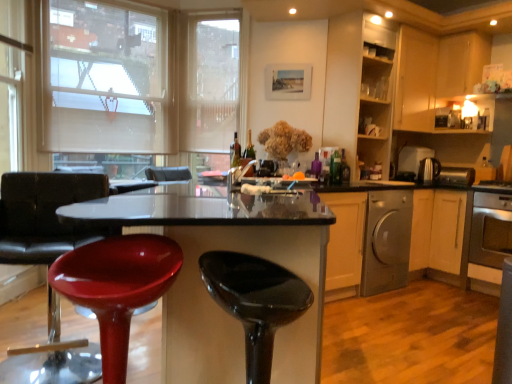
The width and height of the screenshot is (512, 384). What are the coordinates of `translucent fabric at center, positioned as the second window screen in left-to-right order` in the screenshot? It's located at click(210, 84).

Locate an element on the screen. Image resolution: width=512 pixels, height=384 pixels. glossy black bar stool at center is located at coordinates (255, 302).

In order to face glossy black bar stool at center, should I rotate leftwards or rightwards?

Rotate your view right by about 0.497°.

What is the approximate width of glossy plastic table at center?

3.57 feet.

The width and height of the screenshot is (512, 384). I want to click on wooden cabinet at upper right, which is the third cabinetry in right-to-left order, so click(x=359, y=89).

From a real-world perspective, which cabinetry is the 1st one above the green glass bottle at center, the 3th bottle when ordered from right to left? Please provide its 2D coordinates.

[(359, 89)]

Who is smaller, green glass bottle at center, the 3th bottle when ordered from right to left, or wooden cabinet at upper right, which is the first cabinetry in left-to-right order?

With smaller size is green glass bottle at center, the 3th bottle when ordered from right to left.

Is green glass bottle at center, the 3th bottle when ordered from right to left, not within wooden cabinet at upper right, which is the first cabinetry in left-to-right order?

green glass bottle at center, the 3th bottle when ordered from right to left, lies outside wooden cabinet at upper right, which is the first cabinetry in left-to-right order,'s area.

Consider the image. Is wooden cabinet at upper right, the 1th cabinetry in the right-to-left sequence, aimed at green glass bottle at center, which is the first bottle in left-to-right order?

No, wooden cabinet at upper right, the 1th cabinetry in the right-to-left sequence, is not aimed at green glass bottle at center, which is the first bottle in left-to-right order.

From the image's perspective, does wooden cabinet at upper right, the third cabinetry from the left, appear higher than green glass bottle at center, which is the first bottle in left-to-right order?

Yes, from the image's perspective, wooden cabinet at upper right, the third cabinetry from the left, is over green glass bottle at center, which is the first bottle in left-to-right order.

From a real-world perspective, which is physically below, wooden cabinet at upper right, the 1th cabinetry in the right-to-left sequence, or green glass bottle at center, which is the first bottle in left-to-right order?

green glass bottle at center, which is the first bottle in left-to-right order.

Could you measure the distance between glossy black bar stool at center and metallic silver toaster at right, marked as the 1th appliance in a right-to-left arrangement?

glossy black bar stool at center and metallic silver toaster at right, marked as the 1th appliance in a right-to-left arrangement, are 9.46 feet apart from each other.

Could you tell me if glossy black bar stool at center is turned towards metallic silver toaster at right, the third appliance viewed from the left?

No, glossy black bar stool at center does not turn towards metallic silver toaster at right, the third appliance viewed from the left.

Find the location of a particular element. The width and height of the screenshot is (512, 384). bar stool in front of the metallic silver toaster at right, marked as the 1th appliance in a right-to-left arrangement is located at coordinates (255, 302).

Is glossy black bar stool at center next to metallic silver toaster at right, marked as the 1th appliance in a right-to-left arrangement?

glossy black bar stool at center and metallic silver toaster at right, marked as the 1th appliance in a right-to-left arrangement, are not in contact.

From the image's perspective, would you say silver metallic dishwasher at lower right is positioned over wooden cabinet at upper right, the third cabinetry from the left?

Incorrect, from the image's perspective, silver metallic dishwasher at lower right is lower than wooden cabinet at upper right, the third cabinetry from the left.

From a real-world perspective, which cabinetry is the 3rd one above the silver metallic dishwasher at lower right? Please provide its 2D coordinates.

[(461, 62)]

Considering the positions of objects silver metallic dishwasher at lower right and wooden cabinet at upper right, the third cabinetry from the left, in the image provided, who is more to the right, silver metallic dishwasher at lower right or wooden cabinet at upper right, the third cabinetry from the left,?

From the viewer's perspective, wooden cabinet at upper right, the third cabinetry from the left, appears more on the right side.

Is silver metallic dishwasher at lower right situated inside wooden cabinet at upper right, the third cabinetry from the left, or outside?

The correct answer is: outside.

Which of these two, green glass bottle at center, which is the first bottle in left-to-right order, or metallic silver toaster at right, the third appliance viewed from the left, is thinner?

With smaller width is green glass bottle at center, which is the first bottle in left-to-right order.

From the image's perspective, does green glass bottle at center, the 3th bottle when ordered from right to left, appear higher than metallic silver toaster at right, marked as the 1th appliance in a right-to-left arrangement?

Yes, from the image's perspective, green glass bottle at center, the 3th bottle when ordered from right to left, is over metallic silver toaster at right, marked as the 1th appliance in a right-to-left arrangement.

How much distance is there between green glass bottle at center, which is the first bottle in left-to-right order, and metallic silver toaster at right, marked as the 1th appliance in a right-to-left arrangement?

A distance of 6.96 feet exists between green glass bottle at center, which is the first bottle in left-to-right order, and metallic silver toaster at right, marked as the 1th appliance in a right-to-left arrangement.

Is green glass bottle at center, which is the first bottle in left-to-right order, closer to the viewer compared to metallic silver toaster at right, the third appliance viewed from the left?

Yes, the depth of green glass bottle at center, which is the first bottle in left-to-right order, is less than that of metallic silver toaster at right, the third appliance viewed from the left.

From the image's perspective, is wooden cabinet at upper right, the third cabinetry from the left, beneath translucent glass bottle at center, positioned as the 2th bottle in left-to-right order?

Incorrect, from the image's perspective, wooden cabinet at upper right, the third cabinetry from the left, is higher than translucent glass bottle at center, positioned as the 2th bottle in left-to-right order.

Where is `cabinetry that is the 3rd object above the translucent glass bottle at center, which is the second bottle in right-to-left order (from a real-world perspective)`? cabinetry that is the 3rd object above the translucent glass bottle at center, which is the second bottle in right-to-left order (from a real-world perspective) is located at coordinates (461, 62).

Which of these two, wooden cabinet at upper right, the third cabinetry from the left, or translucent glass bottle at center, positioned as the 2th bottle in left-to-right order, stands taller?

Standing taller between the two is wooden cabinet at upper right, the third cabinetry from the left.

Does point (475, 75) come behind point (248, 137)?

No, it is not.

Is point (463, 170) more distant than point (457, 46)?

Yes, point (463, 170) is behind point (457, 46).

From a real-world perspective, is metallic silver toaster at right, the third appliance viewed from the left, on wooden cabinet at upper right, which is the second cabinetry in left-to-right order?

No, from a real-world perspective, metallic silver toaster at right, the third appliance viewed from the left, is not above wooden cabinet at upper right, which is the second cabinetry in left-to-right order.

Is metallic silver toaster at right, marked as the 1th appliance in a right-to-left arrangement, looking in the opposite direction of wooden cabinet at upper right, which is the second cabinetry in left-to-right order?

No.

In terms of size, does metallic silver toaster at right, the third appliance viewed from the left, appear bigger or smaller than wooden cabinet at upper right, marked as the second cabinetry in a right-to-left arrangement?

In the image, metallic silver toaster at right, the third appliance viewed from the left, appears to be smaller than wooden cabinet at upper right, marked as the second cabinetry in a right-to-left arrangement.

The height and width of the screenshot is (384, 512). I want to click on bottle that is the 2nd one below the wooden cabinet at upper right, which is the first cabinetry in left-to-right order (from a real-world perspective), so click(234, 152).

What are the coordinates of `the 3rd bottle to the left of the wooden cabinet at upper right, the third cabinetry from the left, counting from the anchor's position` in the screenshot? It's located at (234, 152).

From the picture: Which object lies nearer to the anchor point glossy plastic stool at center, the 1th chair when ordered from front to back, wooden cabinet at upper right, which is the second cabinetry in left-to-right order, or glossy black bar stool at center?

Based on the image, glossy black bar stool at center appears to be nearer to glossy plastic stool at center, the 1th chair when ordered from front to back.

Which object lies nearer to the anchor point translucent fabric at center, which ranks as the first window screen in right-to-left order, matte glass bottle at center, arranged as the third bottle when viewed from the left, or wooden cabinet at upper right, which is the third cabinetry in right-to-left order?

The object closer to translucent fabric at center, which ranks as the first window screen in right-to-left order, is wooden cabinet at upper right, which is the third cabinetry in right-to-left order.

Looking at the image, which one is located further to silver metallic dishwasher at lower right, metallic silver toaster at right, the second appliance viewed from the right, or silver metallic oven at lower right?

metallic silver toaster at right, the second appliance viewed from the right.

Which object lies nearer to the anchor point metallic silver toaster at right, marked as the 1th appliance in a right-to-left arrangement, glossy plastic stool at center, the 2th chair positioned from the left, or wooden cabinet at upper right, the third cabinetry from the left?

wooden cabinet at upper right, the third cabinetry from the left, is positioned closer to the anchor metallic silver toaster at right, marked as the 1th appliance in a right-to-left arrangement.

Consider the image. Looking at the image, which one is located closer to matte glass bottle at center, arranged as the third bottle when viewed from the left, metallic silver toaster at right, the second appliance viewed from the right, or translucent glass bottle at center, which is the second bottle in right-to-left order?

translucent glass bottle at center, which is the second bottle in right-to-left order, lies closer to matte glass bottle at center, arranged as the third bottle when viewed from the left, than the other object.

When comparing their distances from translucent fabric at center, positioned as the second window screen in left-to-right order, does metallic silver toaster at right, the 2th appliance from the left, or glossy plastic stool at center, which is the 1th chair in left-to-right order, seem closer?

Among the two, glossy plastic stool at center, which is the 1th chair in left-to-right order, is located nearer to translucent fabric at center, positioned as the second window screen in left-to-right order.

Looking at the image, which one is located closer to green glass bottle at center, the 3th bottle when ordered from right to left, wooden cabinet at upper right, which is the second cabinetry in left-to-right order, or glossy plastic stool at center, the 2th chair positioned from the left?

The object closer to green glass bottle at center, the 3th bottle when ordered from right to left, is glossy plastic stool at center, the 2th chair positioned from the left.

Based on their spatial positions, is glossy plastic table at center or glossy plastic stool at center, which is the 1th chair in left-to-right order, closer to beige fabric window screen at upper left, which appears as the 1th window screen when viewed from the left?

Based on the image, glossy plastic stool at center, which is the 1th chair in left-to-right order, appears to be nearer to beige fabric window screen at upper left, which appears as the 1th window screen when viewed from the left.

Where is `kitchen appliance between glossy plastic stool at center, acting as the 2th chair starting from the front, and silver metallic oven at lower right, in the horizontal direction`? The width and height of the screenshot is (512, 384). kitchen appliance between glossy plastic stool at center, acting as the 2th chair starting from the front, and silver metallic oven at lower right, in the horizontal direction is located at coordinates (386, 241).

I want to click on table between beige fabric window screen at upper left, which is the second window screen in right-to-left order, and metallic silver toaster at right, marked as the 1th appliance in a right-to-left arrangement, from left to right, so click(227, 250).

You are a GUI agent. You are given a task and a screenshot of the screen. Output one action in this format:
    pyautogui.click(x=<x>, y=<y>)
    Task: Click on the window screen between glossy plastic stool at center, acting as the 2th chair starting from the front, and metallic silver toaster at right, marked as the 1th appliance in a right-to-left arrangement, in the horizontal direction
    
    Given the screenshot: What is the action you would take?
    pyautogui.click(x=210, y=84)

Find the location of a particular element. The image size is (512, 384). cabinetry located between matte glass bottle at center, acting as the 1th bottle starting from the right, and metallic silver toaster at right, which ranks as the third appliance in right-to-left order, in the left-right direction is located at coordinates (359, 89).